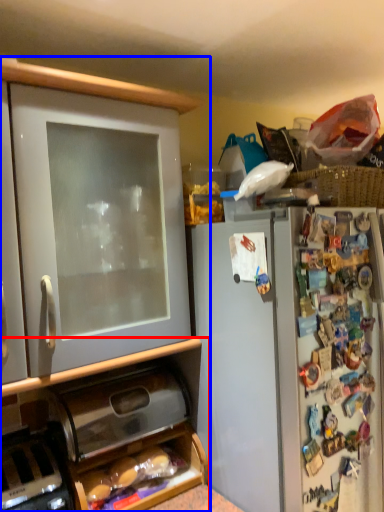
Question: Which of the following is the farthest to the observer, cabinetry (highlighted by a red box) or cabinetry (highlighted by a blue box)?

Choices:
 (A) cabinetry
 (B) cabinetry

Answer: (A)